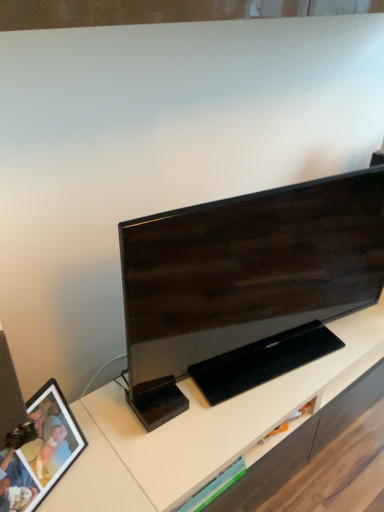
Question: Considering the positions of matte black picture frame at lower left and matte black tv at center in the image, is matte black picture frame at lower left taller or shorter than matte black tv at center?

Choices:
 (A) tall
 (B) short

Answer: (B)

Question: Would you say matte black picture frame at lower left is to the left or to the right of matte black tv at center in the picture?

Choices:
 (A) left
 (B) right

Answer: (A)

Question: Does point (18, 456) appear closer or farther from the camera than point (382, 196)?

Choices:
 (A) farther
 (B) closer

Answer: (B)

Question: Does point (278, 362) appear closer or farther from the camera than point (36, 392)?

Choices:
 (A) farther
 (B) closer

Answer: (A)

Question: In the image, is matte black tv at center on the left side or the right side of matte black picture frame at lower left?

Choices:
 (A) left
 (B) right

Answer: (B)

Question: Relative to matte black picture frame at lower left, is matte black tv at center in front or behind?

Choices:
 (A) front
 (B) behind

Answer: (B)

Question: Which is correct: matte black tv at center is inside matte black picture frame at lower left, or outside of it?

Choices:
 (A) inside
 (B) outside

Answer: (B)